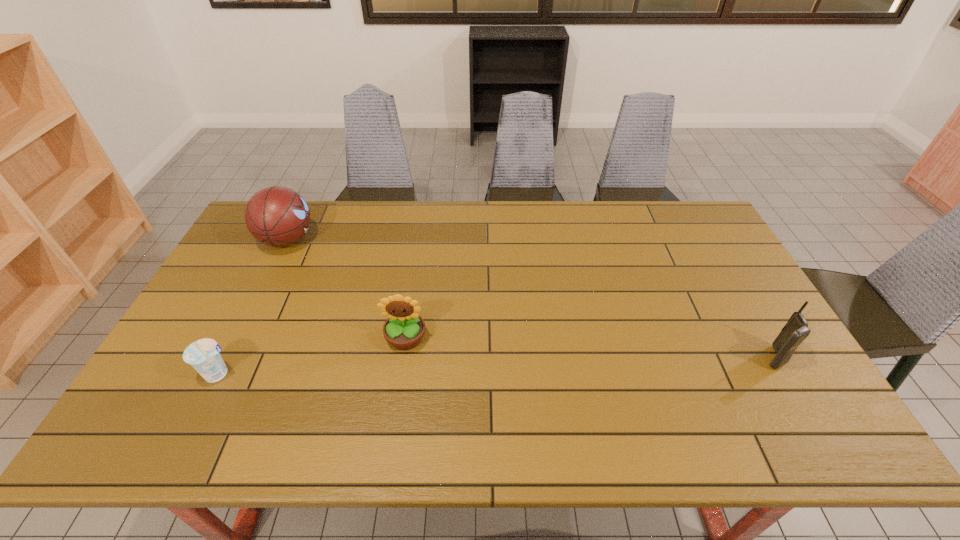
Identify the location of free space between the second object from right to left and the farthest object. The width and height of the screenshot is (960, 540). (347, 289).

What are the coordinates of `vacant space that is in between the third object from left to right and the farthest object` in the screenshot? It's located at (347, 289).

Where is `vacant area that lies between the third object from left to right and the cellular telephone`? This screenshot has height=540, width=960. vacant area that lies between the third object from left to right and the cellular telephone is located at coordinates (589, 348).

The width and height of the screenshot is (960, 540). What are the coordinates of `free space between the basketball and the yogurt` in the screenshot? It's located at (253, 307).

The image size is (960, 540). What are the coordinates of `free point between the yogurt and the basketball` in the screenshot? It's located at pyautogui.click(x=253, y=307).

This screenshot has height=540, width=960. Identify the location of empty location between the farthest object and the second object from right to left. (347, 289).

The image size is (960, 540). Identify the location of unoccupied area between the farthest object and the rightmost object. (530, 299).

The height and width of the screenshot is (540, 960). What are the coordinates of `vacant region between the farthest object and the cellular telephone` in the screenshot? It's located at (530, 299).

Identify the location of vacant area that lies between the second object from right to left and the basketball. (347, 289).

Where is `object that is the third closest to the rightmost object`? object that is the third closest to the rightmost object is located at coordinates (203, 355).